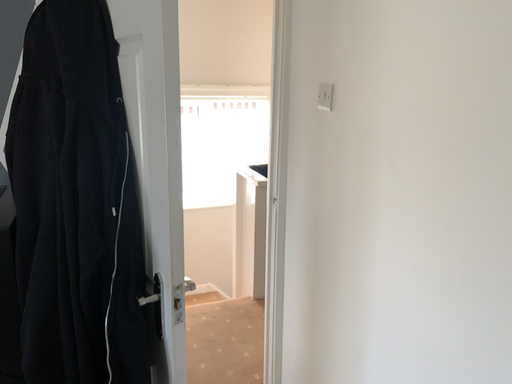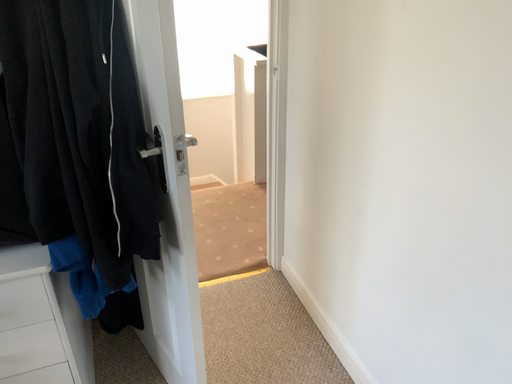
Question: How did the camera likely rotate when shooting the video?

Choices:
 (A) rotated downward
 (B) rotated upward

Answer: (A)